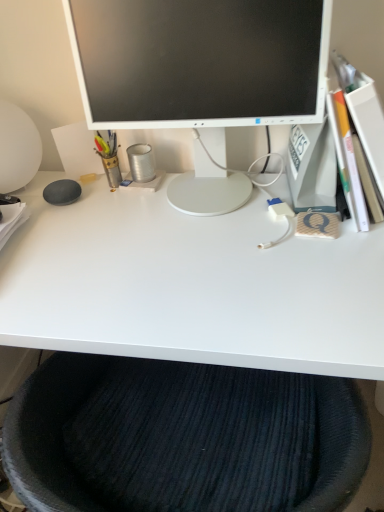
Question: From the image's perspective, is white glossy desk at center above or below dark blue textured cushion at lower center?

Choices:
 (A) below
 (B) above

Answer: (B)

Question: Considering their positions, is white glossy desk at center located in front of or behind dark blue textured cushion at lower center?

Choices:
 (A) front
 (B) behind

Answer: (B)

Question: Which of these objects is positioned farthest from the dark blue textured cushion at lower center?

Choices:
 (A) metallic pen holder at left, which appears as the second stationery when viewed from the right
 (B) white glossy monitor at center
 (C) metallic canister at center, the second stationery in the left-to-right sequence
 (D) white glossy desk at center

Answer: (A)

Question: Estimate the real-world distances between objects in this image. Which object is closer to the white glossy desk at center?

Choices:
 (A) white glossy monitor at center
 (B) metallic canister at center, the second stationery in the left-to-right sequence
 (C) dark blue textured cushion at lower center
 (D) metallic pen holder at left, which appears as the second stationery when viewed from the right

Answer: (C)